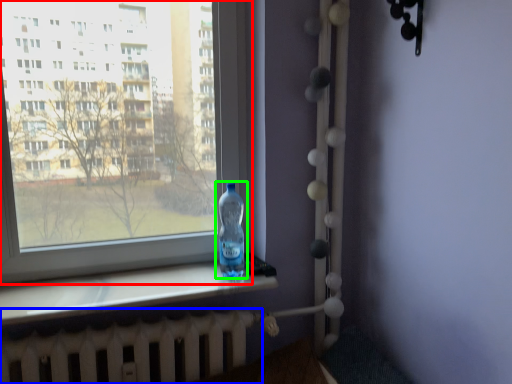
Question: Which object is positioned farthest from window (highlighted by a red box)? Select from radiator (highlighted by a blue box) and bottle (highlighted by a green box).

Choices:
 (A) radiator
 (B) bottle

Answer: (A)